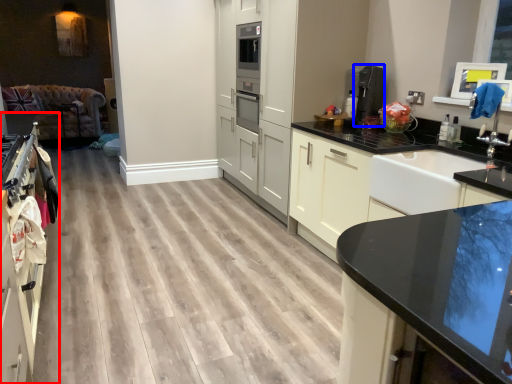
Question: Which object is further to the camera taking this photo, cabinetry (highlighted by a red box) or coffee machine (highlighted by a blue box)?

Choices:
 (A) cabinetry
 (B) coffee machine

Answer: (B)